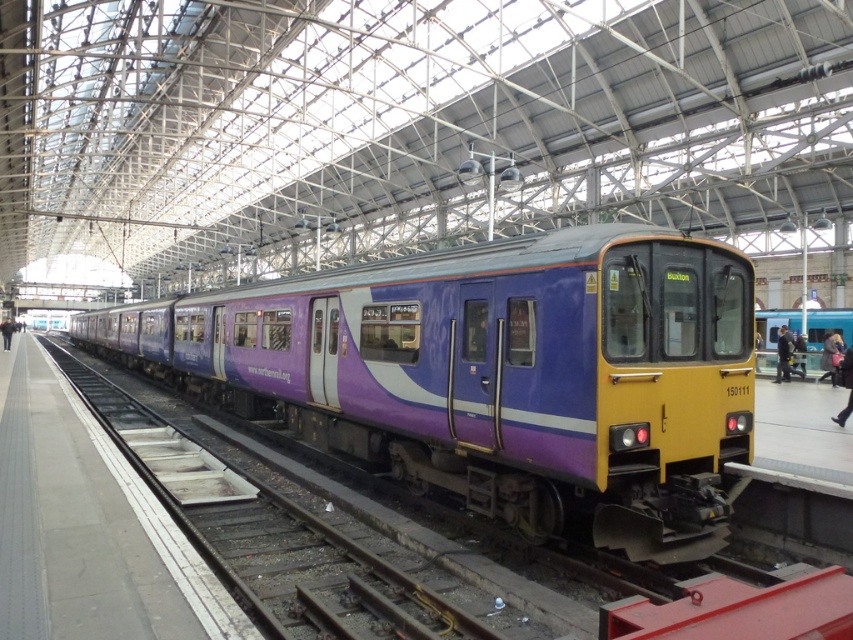
Question: Among these objects, which one is nearest to the camera?

Choices:
 (A) purple glossy train at center
 (B) dark blue jacket at center

Answer: (A)

Question: Can you confirm if purple glossy train at center is bigger than dark blue jacket at center?

Choices:
 (A) no
 (B) yes

Answer: (B)

Question: Can you confirm if purple glossy train at center is positioned to the left of dark blue jacket at center?

Choices:
 (A) no
 (B) yes

Answer: (B)

Question: Is purple glossy train at center positioned in front of dark blue jacket at center?

Choices:
 (A) no
 (B) yes

Answer: (B)